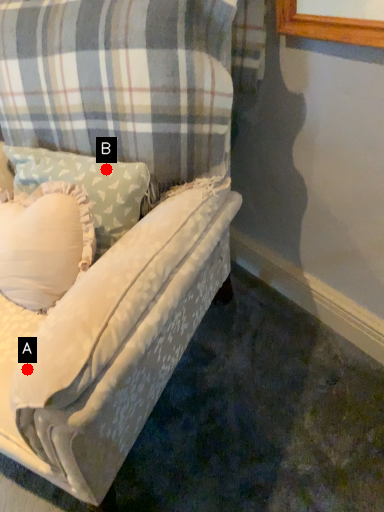
Question: Two points are circled on the image, labeled by A and B beside each circle. Which point is farther from the camera taking this photo?

Choices:
 (A) A is further
 (B) B is further

Answer: (B)